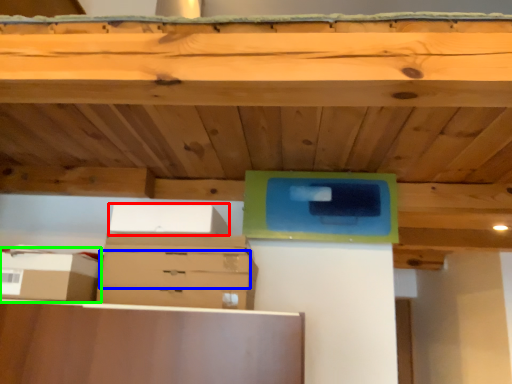
Question: Considering the real-world distances, which object is closest to storage box (highlighted by a red box)? drawer (highlighted by a blue box) or storage box (highlighted by a green box).

Choices:
 (A) drawer
 (B) storage box

Answer: (A)